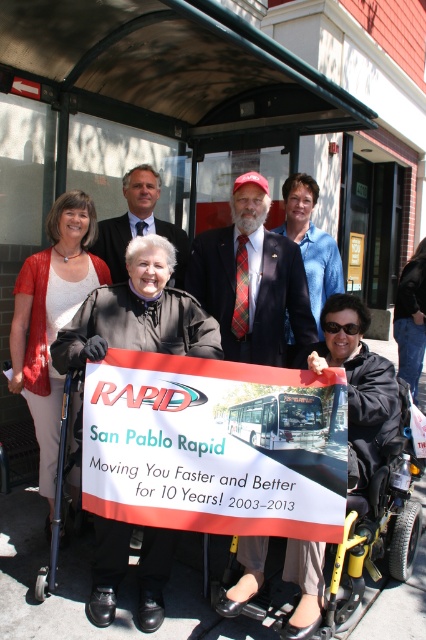
You are a pedestrian trying to read the sign at the bus stop. The white paper sign at center and the dark blue suit at center are both in your line of sight. Which one do you think is wider?

The white paper sign at center is wider than the dark blue suit at center.

You are a photographer at the event and want to capture a closeup shot of the plaid fabric tie at center and dark blue suit at center. Which one would you need to zoom in more on to fill the frame?

The plaid fabric tie at center occupies less space than the dark blue suit at center, so you would need to zoom in more on the plaid fabric tie at center to fill the frame.

From the picture: You are a pedestrian passing by the bus stop and notice the white paper sign at center and the plaid fabric tie at center. Which object is positioned lower in the scene?

The white paper sign at center is located below the plaid fabric tie at center, so the white paper sign at center is positioned lower in the scene.